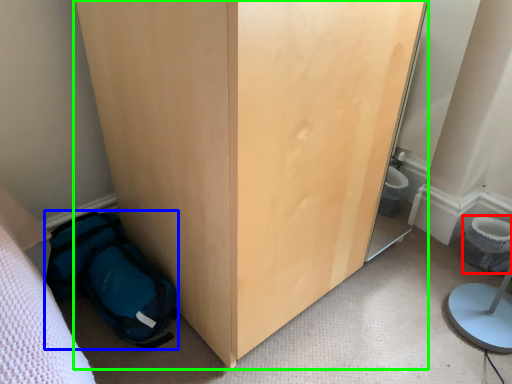
Question: Estimate the real-world distances between objects in this image. Which object is closer to toilet bowl (highlighted by a red box), backpack (highlighted by a blue box) or furniture (highlighted by a green box)?

Choices:
 (A) backpack
 (B) furniture

Answer: (B)